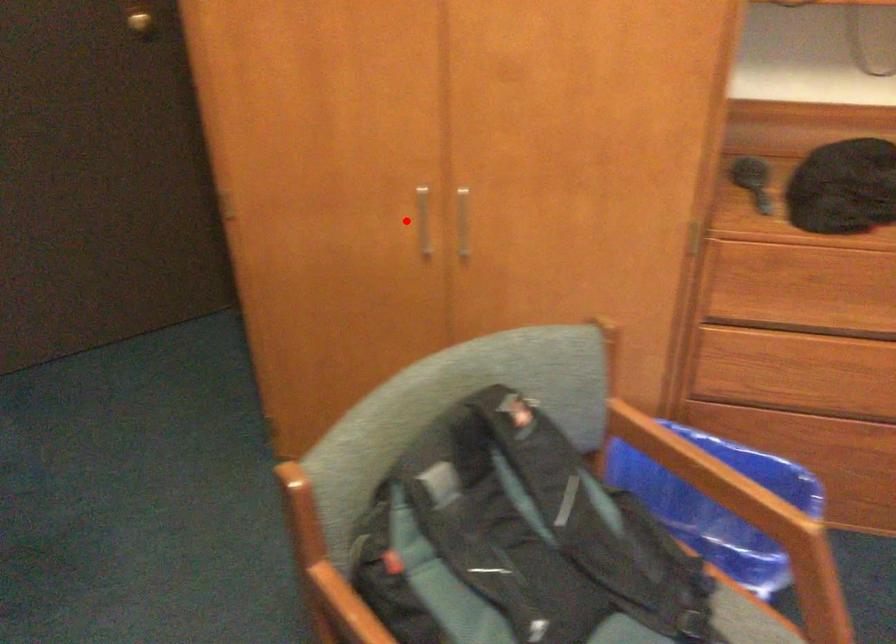
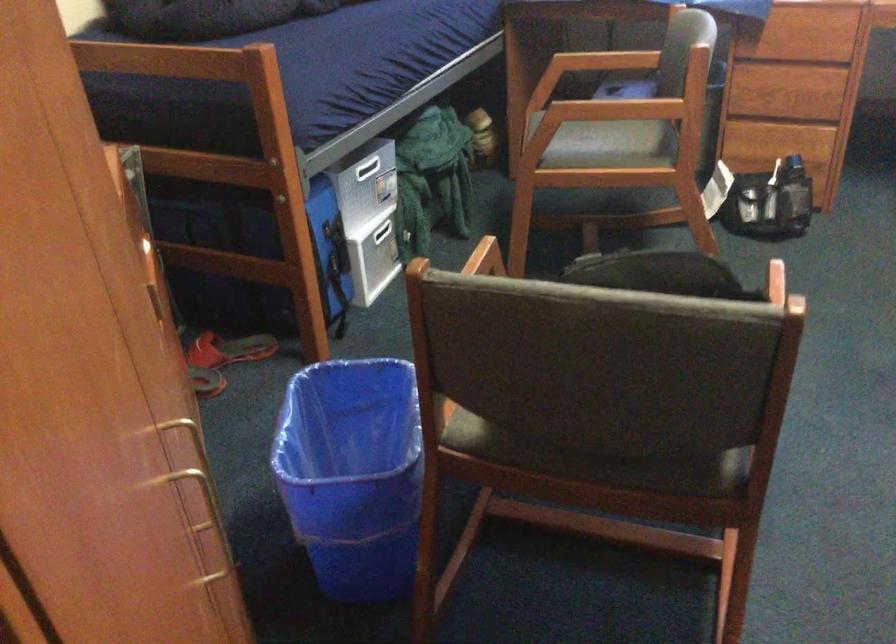
Question: I am providing you with two images of the same scene from different viewpoints. Image1 has a red point marked. In image2, the corresponding 3D location appears at what relative position? Reply with the corresponding letter.

Choices:
 (A) Closer
 (B) Farther

Answer: (A)